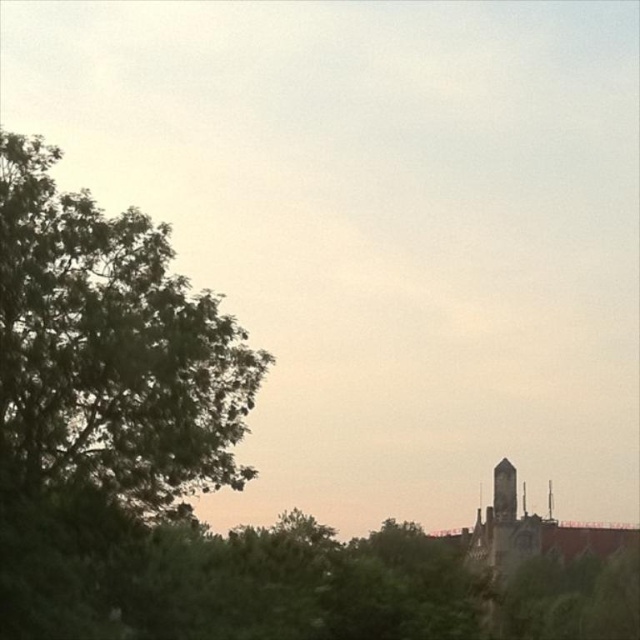
You are an architect examining the scene and want to know which structure is nearer to you between the dark gray stone tower at right and the smooth stone spire at upper right. Can you determine this based on their positions?

The dark gray stone tower at right is closer to the viewer than the smooth stone spire at upper right.

You are an architect analyzing the layout of this outdoor area. You need to determine the spatial relationship between the dark gray stone tower at right and the smooth stone spire at upper right. Which object is located above the other?

The dark gray stone tower at right is positioned over the smooth stone spire at upper right, meaning the tower is above the spire.